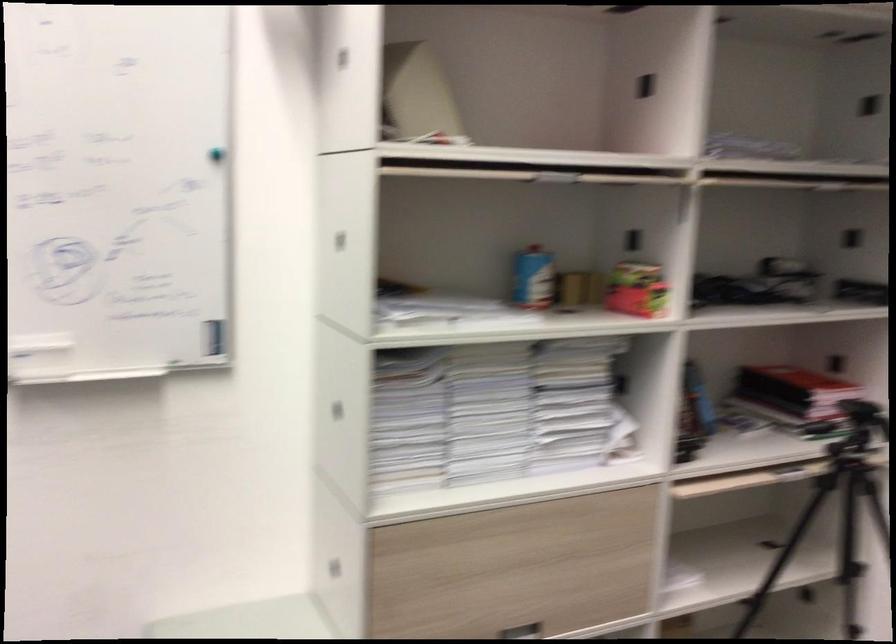
Find where to pull the silver drawer handle. Please return your answer as a coordinate pair (x, y).

(522, 630)